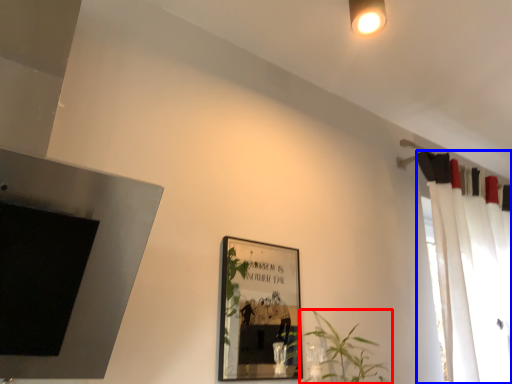
Question: Which of the following is the closest to the observer, houseplant (highlighted by a red box) or curtain (highlighted by a blue box)?

Choices:
 (A) houseplant
 (B) curtain

Answer: (A)